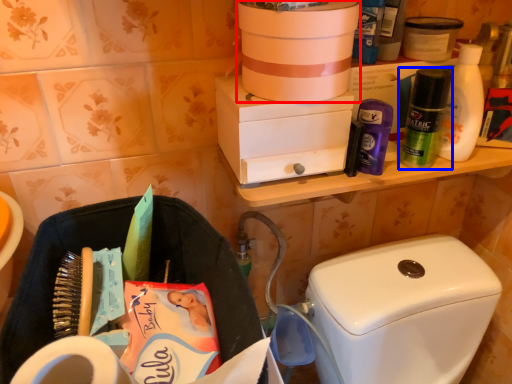
Question: Which of the following is the closest to the observer, box (highlighted by a red box) or toiletry (highlighted by a blue box)?

Choices:
 (A) box
 (B) toiletry

Answer: (A)